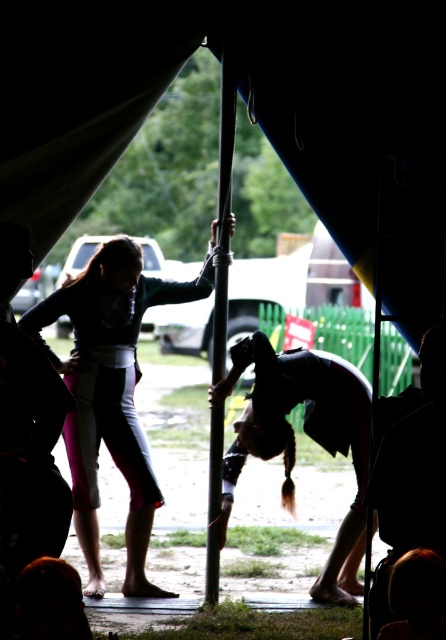
You are a photographer inside the tent. You want to capture a photo where the dark brown hair at center is visible above the metallic pole at center. Is this possible based on their current positions?

The dark brown hair at center is below the metallic pole at center, so it cannot be seen above the pole in the current position.

You are a photographer inside the tent and want to capture the metallic pole at center and the light pink fabric pants at center in the same frame. Based on their positions, which object should you focus on first to ensure both are in focus?

The light pink fabric pants at center is below metallic pole at center. To ensure both are in focus, you should focus on the metallic pole at center first since it is closer to the camera, and the pants will naturally fall into the depth of field if focused on the pole.

You are a photographer inside the tent. You want to capture a photo of the metallic pole at center and the light pink fabric pants at center. From your current position, which object should you frame first in your camera viewfinder to ensure both are in the shot?

The light pink fabric pants at center is positioned on the left side of metallic pole at center, so you should frame the metallic pole at center first to ensure both objects are included in the shot.